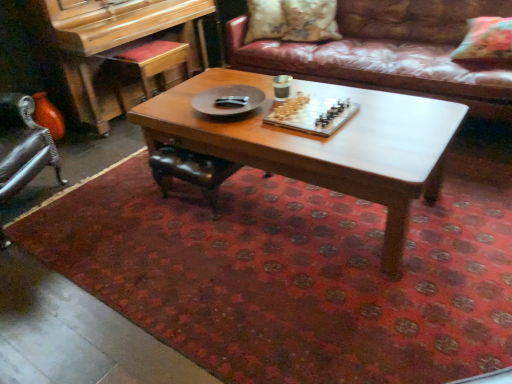
You are a GUI agent. You are given a task and a screenshot of the screen. Output one action in this format:
    pyautogui.click(x=<x>, y=<y>)
    Task: Click on the vacant region below wooden chessboard at center (from a real-world perspective)
    
    Given the screenshot: What is the action you would take?
    pyautogui.click(x=313, y=211)